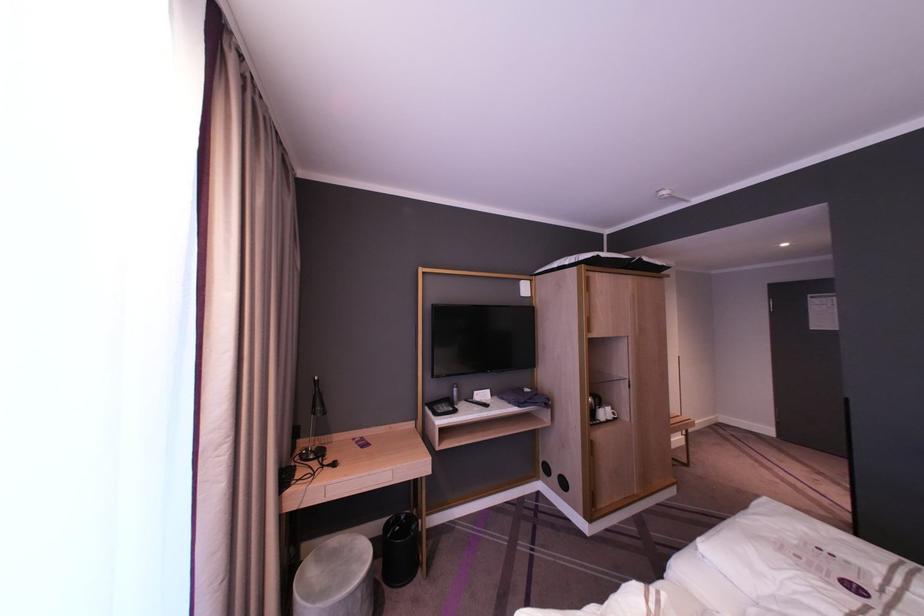
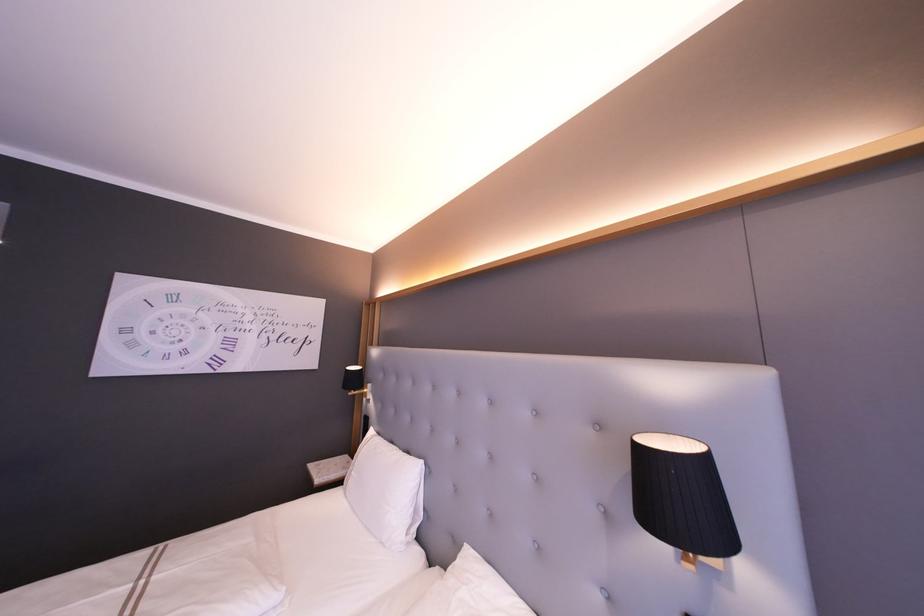
Question: The camera is either moving clockwise (left) or counter-clockwise (right) around the object. The first image is from the beginning of the video and the second image is from the end. Is the camera moving left or right when shooting the video?

Choices:
 (A) Left
 (B) Right

Answer: (A)